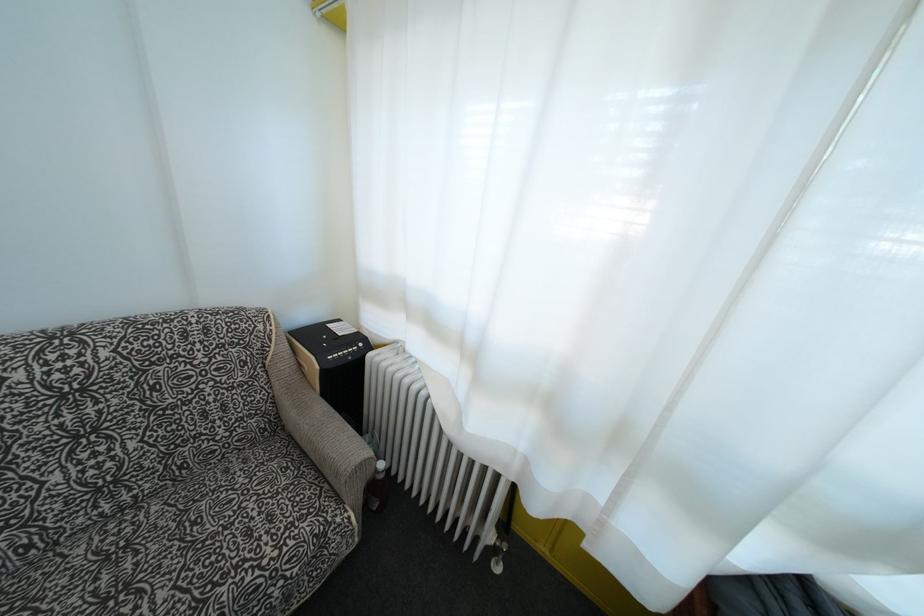
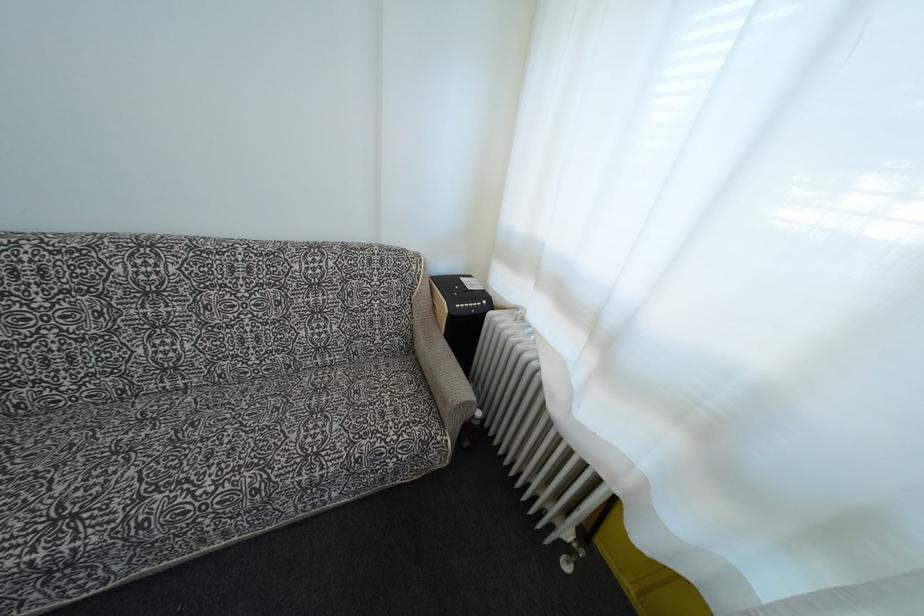
Question: The first image is from the beginning of the video and the second image is from the end. How did the camera likely rotate when shooting the video?

Choices:
 (A) Left
 (B) Right
 (C) Up
 (D) Down

Answer: (A)